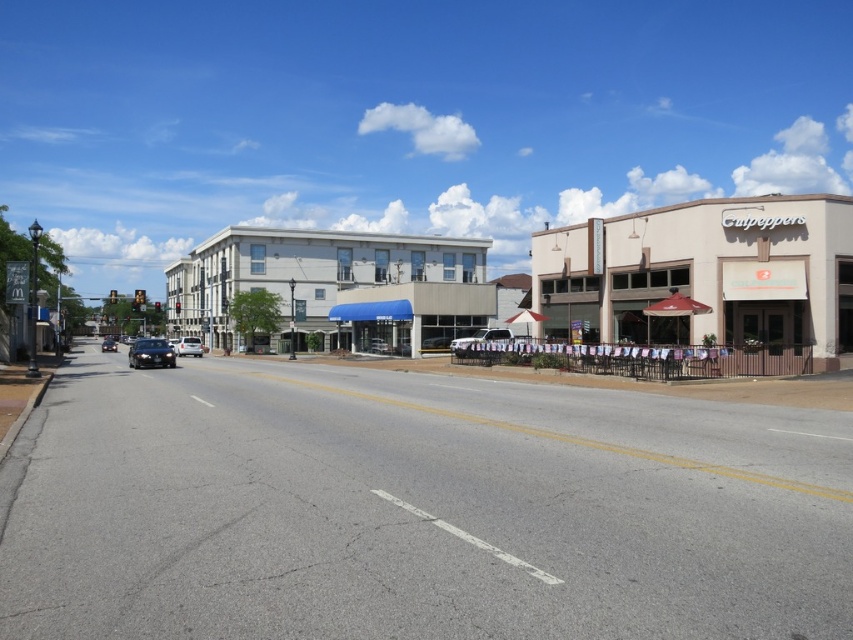
You are driving a satin silver suv at center and want to park it in the Cutpeppers parking lot. The parking lot has spaces marked every 3 meters. How many parking spaces apart are you from the entrance?

The satin silver suv at center is 34.56 meters away from the entrance. Since each parking space is 3 meters long, dividing 34.56 by 3 gives approximately 11.52 parking spaces. Therefore, the suv is about 12 parking spaces away from the entrance.

Based on the photo, you are a delivery driver who needs to park your vehicle near the Cutpeppers cafe. The parking spots are marked by two points on the road surface. The first point is at coordinates point (610, 284) and the second is at point (151, 342). Which parking spot is closer to the cafe entrance?

Point (610, 284) is in front of point (151, 342), so the parking spot at point (610, 284) is closer to the cafe entrance.